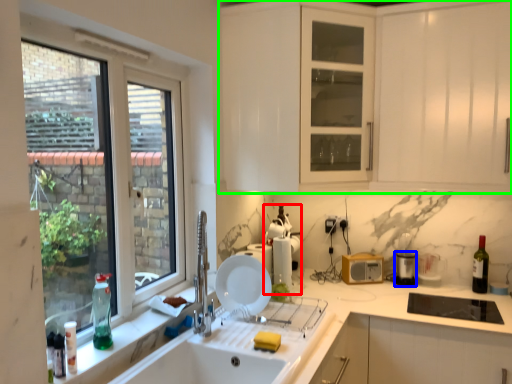
Question: Which object is positioned farthest from appliance (highlighted by a red box)? Select from appliance (highlighted by a blue box) and cabinetry (highlighted by a green box).

Choices:
 (A) appliance
 (B) cabinetry

Answer: (B)